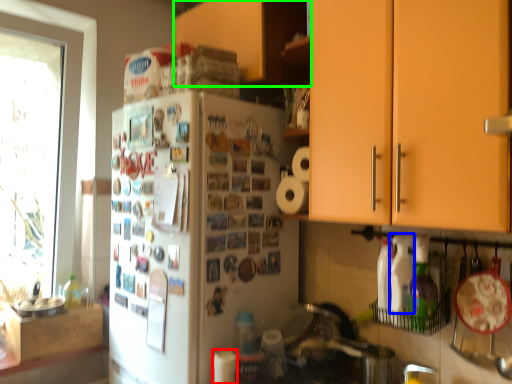
Question: Which object is the closest to the paper towel (highlighted by a red box)? Choose among these: bottle (highlighted by a blue box) or cabinetry (highlighted by a green box).

Choices:
 (A) bottle
 (B) cabinetry

Answer: (A)